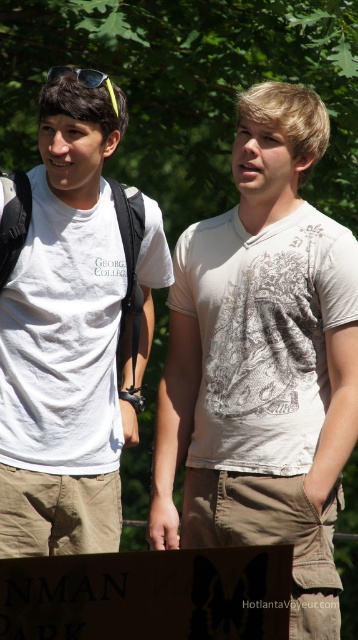
Question: Estimate the real-world distances between objects in this image. Which object is farther from the white cotton t-shirt at left?

Choices:
 (A) sunglassestransparent at left
 (B) white cotton shirt at center

Answer: (A)

Question: Can you confirm if white cotton shirt at center is wider than white cotton t-shirt at left?

Choices:
 (A) yes
 (B) no

Answer: (A)

Question: Among these objects, which one is nearest to the camera?

Choices:
 (A) white cotton shirt at center
 (B) white cotton t-shirt at left
 (C) sunglassestransparent at left

Answer: (B)

Question: Which object is farther from the camera taking this photo?

Choices:
 (A) white cotton t-shirt at left
 (B) white cotton shirt at center
 (C) sunglassestransparent at left

Answer: (B)

Question: From the image, what is the correct spatial relationship of white cotton t-shirt at left in relation to sunglassestransparent at left?

Choices:
 (A) left
 (B) right

Answer: (A)

Question: Does white cotton shirt at center lie behind white cotton t-shirt at left?

Choices:
 (A) yes
 (B) no

Answer: (A)